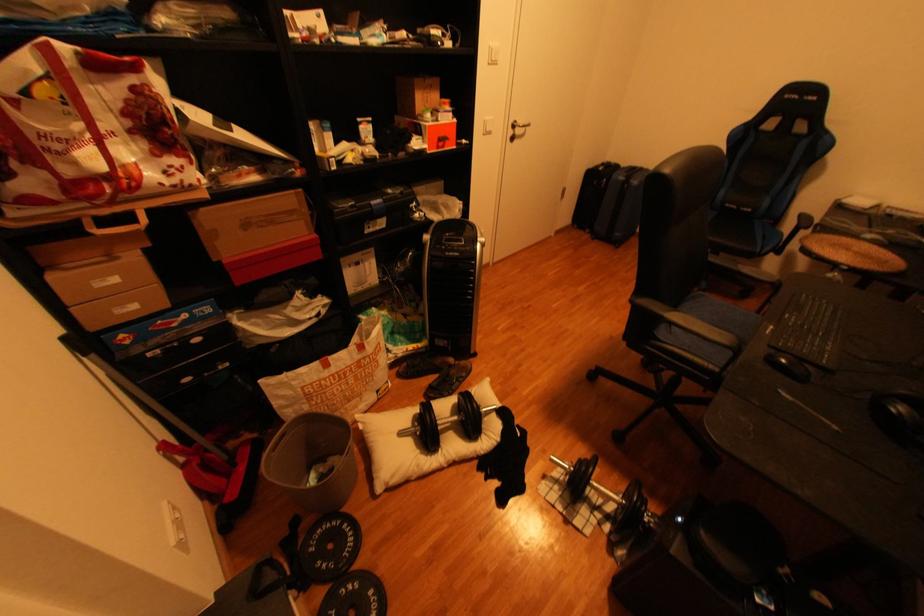
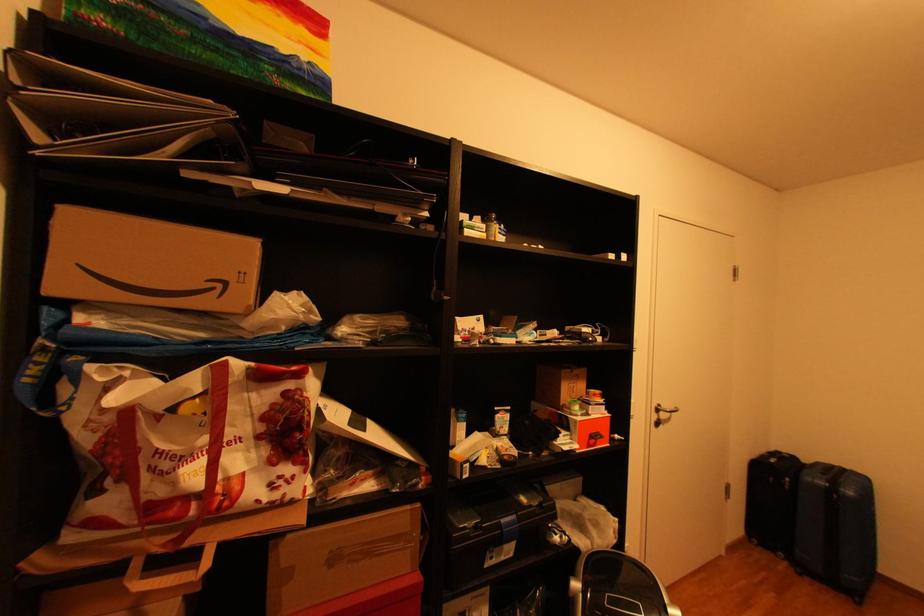
How did the camera likely rotate?

The camera's rotation is toward left-up.